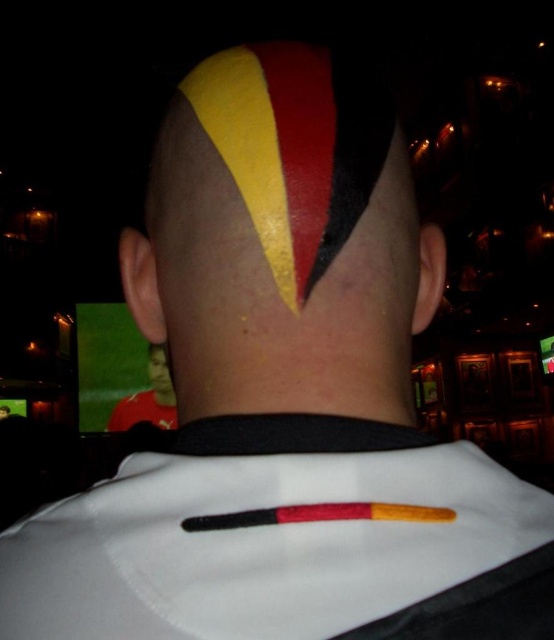
Question: Which of the following is the farthest from the observer?

Choices:
 (A) white cotton dress shirt at center
 (B) black wood crayon at center
 (C) matte black hair at center

Answer: (C)

Question: Which object appears closest to the camera in this image?

Choices:
 (A) white cotton dress shirt at center
 (B) yellow matte paint at upper center

Answer: (A)

Question: Does matte black hair at center lie in front of yellow matte paint at upper center?

Choices:
 (A) yes
 (B) no

Answer: (A)

Question: Is yellow matte paint at upper center above black wood crayon at center?

Choices:
 (A) no
 (B) yes

Answer: (B)

Question: Which object is the farthest from the matte yellow face at center?

Choices:
 (A) white cotton dress shirt at center
 (B) matte black hair at center
 (C) black wood crayon at center
 (D) yellow matte paint at upper center

Answer: (C)

Question: Is white cotton dress shirt at center smaller than matte yellow face at center?

Choices:
 (A) no
 (B) yes

Answer: (B)